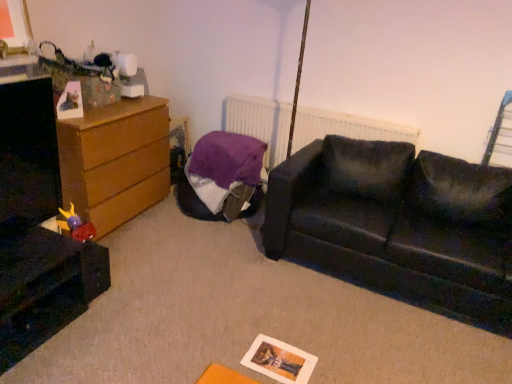
This screenshot has width=512, height=384. In order to click on free space between black glossy file cabinet at lower left and black leather couch at center in this screenshot , I will do `click(226, 304)`.